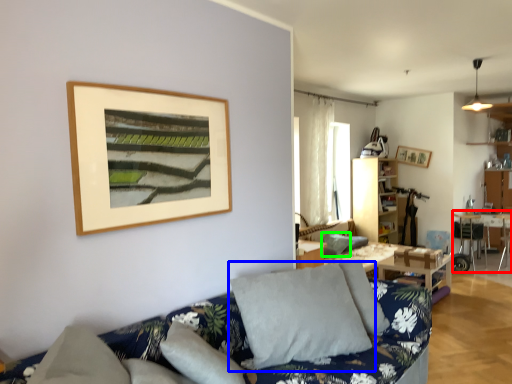
Question: Which is nearer to the table (highlighted by a red box)? pillow (highlighted by a blue box) or pillow (highlighted by a green box).

Choices:
 (A) pillow
 (B) pillow

Answer: (B)